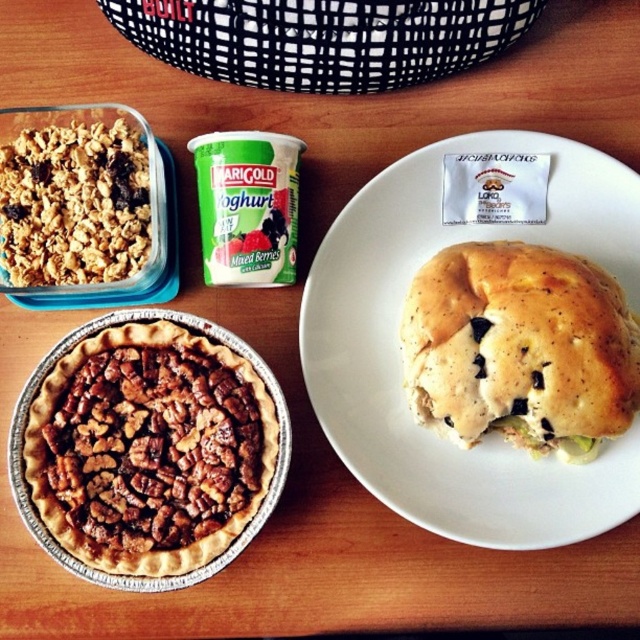
Which of these two, golden brown bread at center or golden bread roll at center-right, stands taller?

golden brown bread at center is taller.

Is golden brown bread at center further to the viewer compared to golden bread roll at center-right?

Yes, golden brown bread at center is behind golden bread roll at center-right.

Which is in front, point (342, 381) or point (577, 257)?

Positioned in front is point (577, 257).

Image resolution: width=640 pixels, height=640 pixels. Find the location of `golden brown bread at center`. golden brown bread at center is located at coordinates (481, 444).

Looking at this image, is brown crumbly pie at lower left closer to the viewer compared to golden bread roll at center-right?

No, it is not.

Which of these two, brown crumbly pie at lower left or golden bread roll at center-right, stands shorter?

Standing shorter between the two is golden bread roll at center-right.

Is point (48, 440) more distant than point (620, 316)?

No, it is not.

Find the location of a particular element. brown crumbly pie at lower left is located at coordinates (148, 449).

Which of these two, golden brown bread at center or crumbly brown granola at upper left, stands shorter?

crumbly brown granola at upper left is shorter.

Looking at this image, does golden brown bread at center appear under crumbly brown granola at upper left?

Indeed, golden brown bread at center is positioned under crumbly brown granola at upper left.

I want to click on golden brown bread at center, so click(x=481, y=444).